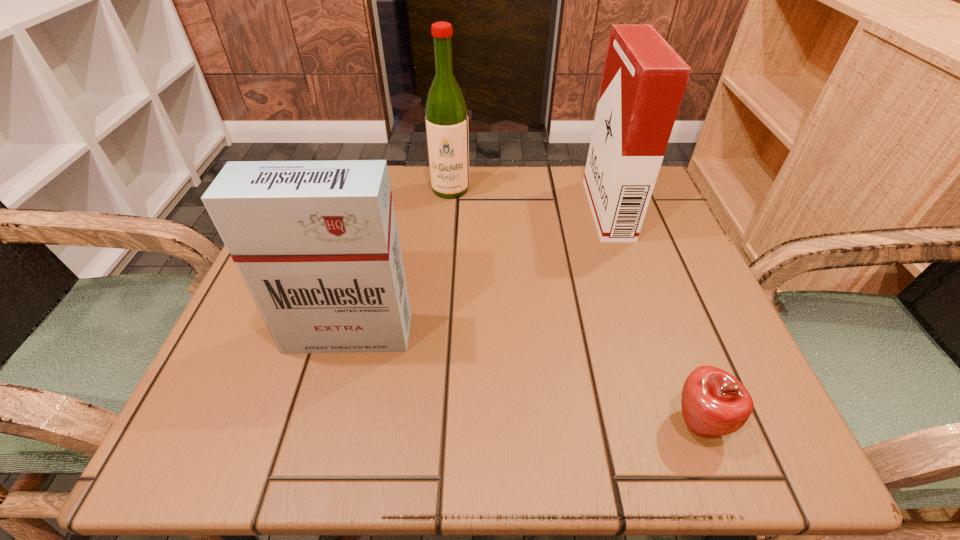
At what (x,y) coordinates should I click in order to perform the action: click on vacant area situated on the back of the leftmost object. Please return your answer as a coordinate pair (x, y). The height and width of the screenshot is (540, 960). Looking at the image, I should click on (375, 232).

Locate an element on the screen. This screenshot has width=960, height=540. free space located on the back of the nearest object is located at coordinates (640, 269).

You are a GUI agent. You are given a task and a screenshot of the screen. Output one action in this format:
    pyautogui.click(x=<x>, y=<y>)
    Task: Click on the liquor present at the far edge
    This screenshot has width=960, height=540.
    Given the screenshot: What is the action you would take?
    pyautogui.click(x=446, y=118)

Identify the location of cigarette_case located in the far edge section of the desktop. point(644,79).

Find the location of a particular element. object located at the near edge is located at coordinates (714, 403).

The image size is (960, 540). I want to click on object situated at the left edge, so click(x=316, y=243).

Where is `cigarette_case that is at the right edge`? The image size is (960, 540). cigarette_case that is at the right edge is located at coordinates (644, 79).

Identify the location of apple that is at the right edge. (714, 403).

At what (x,y) coordinates should I click in order to perform the action: click on object that is at the far right corner. Please return your answer as a coordinate pair (x, y). The width and height of the screenshot is (960, 540). Looking at the image, I should click on (644, 79).

Where is `object at the near right corner`? This screenshot has width=960, height=540. object at the near right corner is located at coordinates (714, 403).